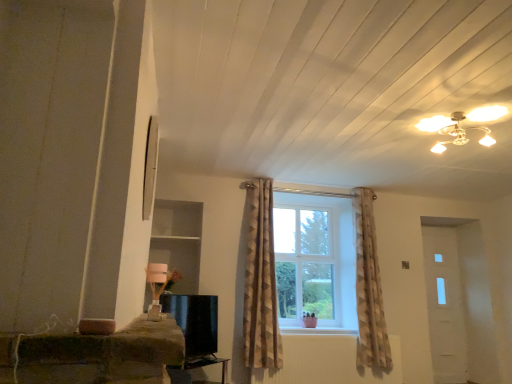
Question: Is brown textured curtain at center facing away from black glossy tv at lower center?

Choices:
 (A) no
 (B) yes

Answer: (A)

Question: Are brown textured curtain at center and black glossy tv at lower center far apart?

Choices:
 (A) no
 (B) yes

Answer: (A)

Question: Would you say brown textured curtain at center is outside black glossy tv at lower center?

Choices:
 (A) no
 (B) yes

Answer: (B)

Question: Considering the relative sizes of brown textured curtain at center and black glossy tv at lower center in the image provided, is brown textured curtain at center bigger than black glossy tv at lower center?

Choices:
 (A) yes
 (B) no

Answer: (A)

Question: Would you say black glossy tv at lower center is part of brown textured curtain at center's contents?

Choices:
 (A) yes
 (B) no

Answer: (B)

Question: From the image's perspective, is brown textured curtain at center below black glossy tv at lower center?

Choices:
 (A) yes
 (B) no

Answer: (B)

Question: From the image's perspective, would you say black glossy tv at lower center is positioned over black glossy tv stand at lower center?

Choices:
 (A) yes
 (B) no

Answer: (A)

Question: Could black glossy tv stand at lower center be considered to be inside black glossy tv at lower center?

Choices:
 (A) yes
 (B) no

Answer: (B)

Question: Does black glossy tv at lower center have a greater width compared to black glossy tv stand at lower center?

Choices:
 (A) no
 (B) yes

Answer: (A)

Question: Is black glossy tv at lower center taller than black glossy tv stand at lower center?

Choices:
 (A) yes
 (B) no

Answer: (A)

Question: Is black glossy tv at lower center to the right of black glossy tv stand at lower center from the viewer's perspective?

Choices:
 (A) no
 (B) yes

Answer: (A)

Question: From the image's perspective, is black glossy tv at lower center under black glossy tv stand at lower center?

Choices:
 (A) no
 (B) yes

Answer: (A)

Question: Can you confirm if black glossy tv at lower center is positioned to the left of brown textured curtain at center?

Choices:
 (A) yes
 (B) no

Answer: (A)